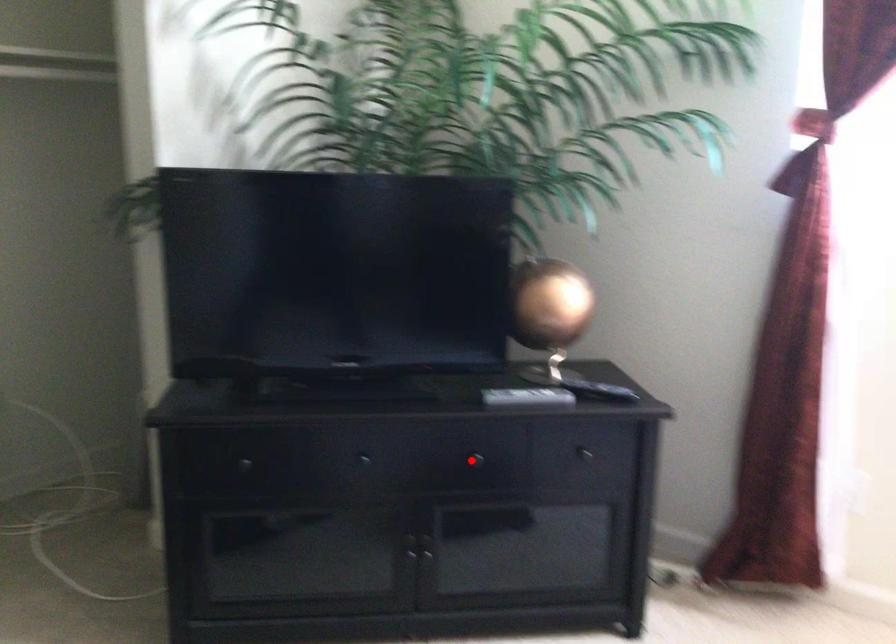
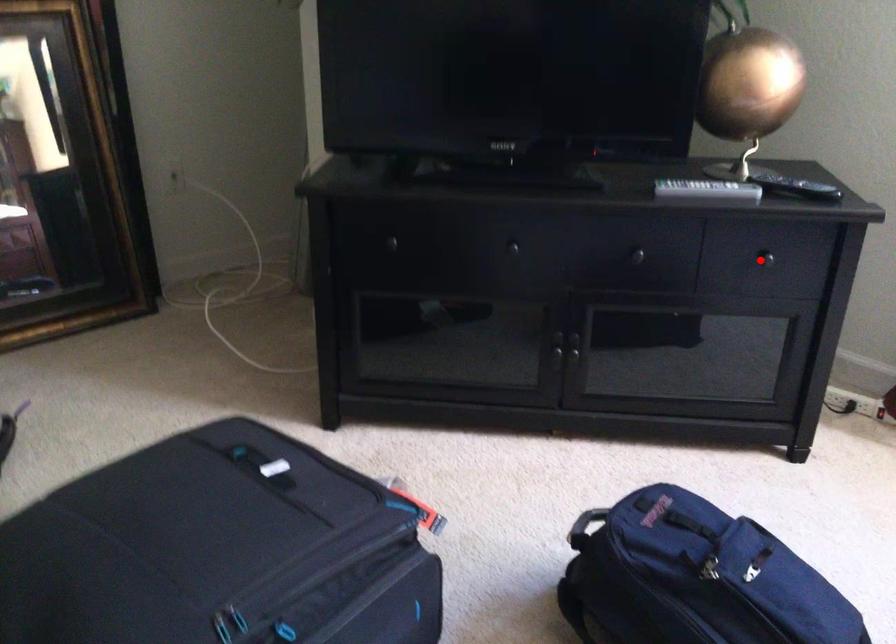
I am providing you with two images of the same scene from different viewpoints. A red point is marked on the first image and another point is marked on the second image. Does the point marked in image1 correspond to the same location as the one in image2?

No